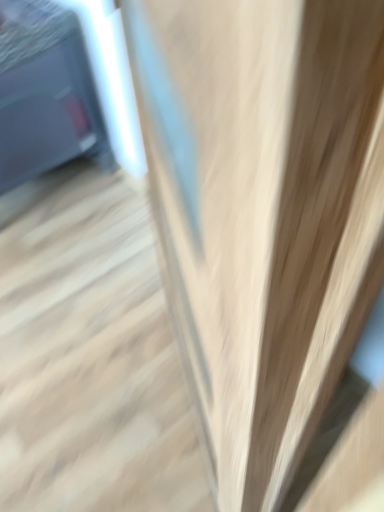
Question: Is matte black tv at left in front of or behind light wood stairs at center in the image?

Choices:
 (A) behind
 (B) front

Answer: (A)

Question: From the image's perspective, is matte black tv at left located above or below light wood stairs at center?

Choices:
 (A) above
 (B) below

Answer: (A)

Question: Is matte black tv at left inside the boundaries of light wood stairs at center, or outside?

Choices:
 (A) outside
 (B) inside

Answer: (A)

Question: Does point (44, 502) appear closer or farther from the camera than point (54, 117)?

Choices:
 (A) farther
 (B) closer

Answer: (B)

Question: Relative to matte black tv at left, is light wood stairs at center in front or behind?

Choices:
 (A) front
 (B) behind

Answer: (A)

Question: From the image's perspective, relative to matte black tv at left, is light wood stairs at center above or below?

Choices:
 (A) above
 (B) below

Answer: (B)

Question: From a real-world perspective, is light wood stairs at center above or below matte black tv at left?

Choices:
 (A) above
 (B) below

Answer: (B)